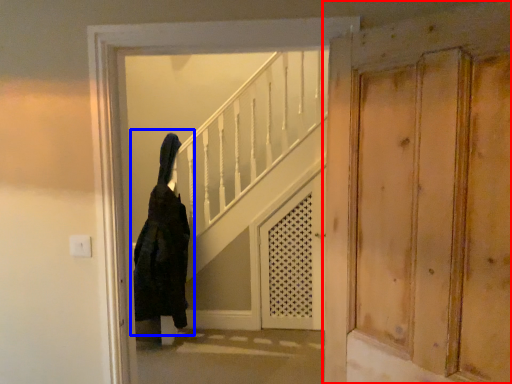
Question: Which object appears closest to the camera in this image, door (highlighted by a red box) or woman (highlighted by a blue box)?

Choices:
 (A) door
 (B) woman

Answer: (A)